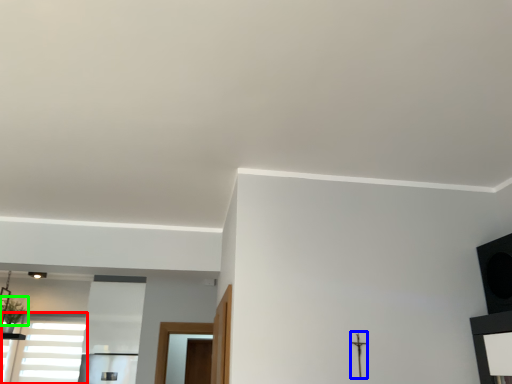
Question: Which object is the farthest from window (highlighted by a red box)? Choose among these: crucifix (highlighted by a blue box) or plant (highlighted by a green box).

Choices:
 (A) crucifix
 (B) plant

Answer: (A)